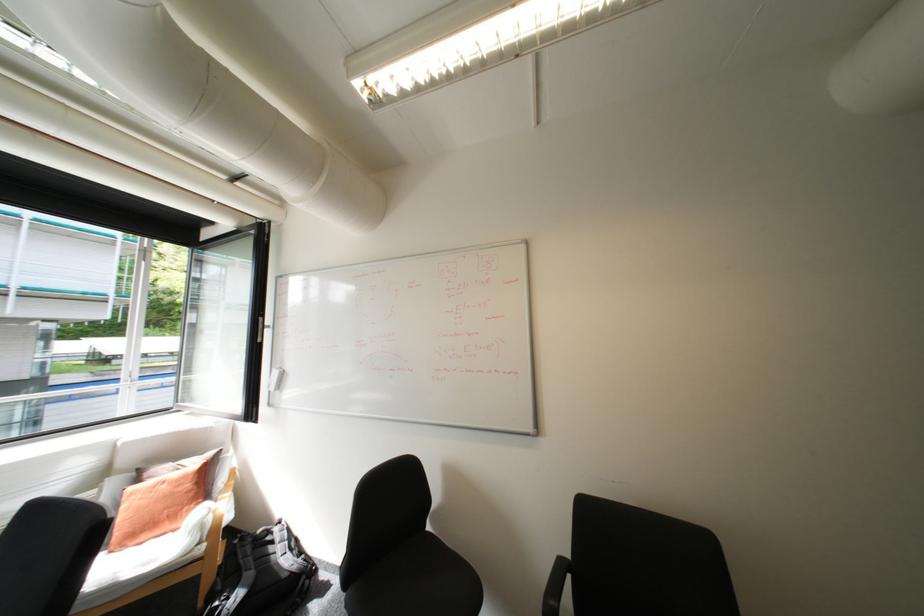
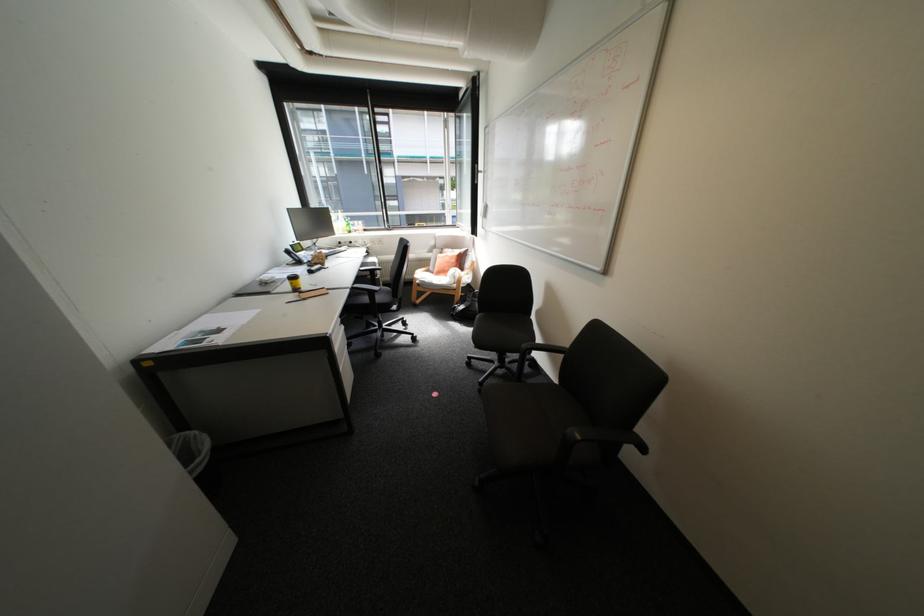
In the second image, find the point that corresponds to [177,464] in the first image.

(459, 249)